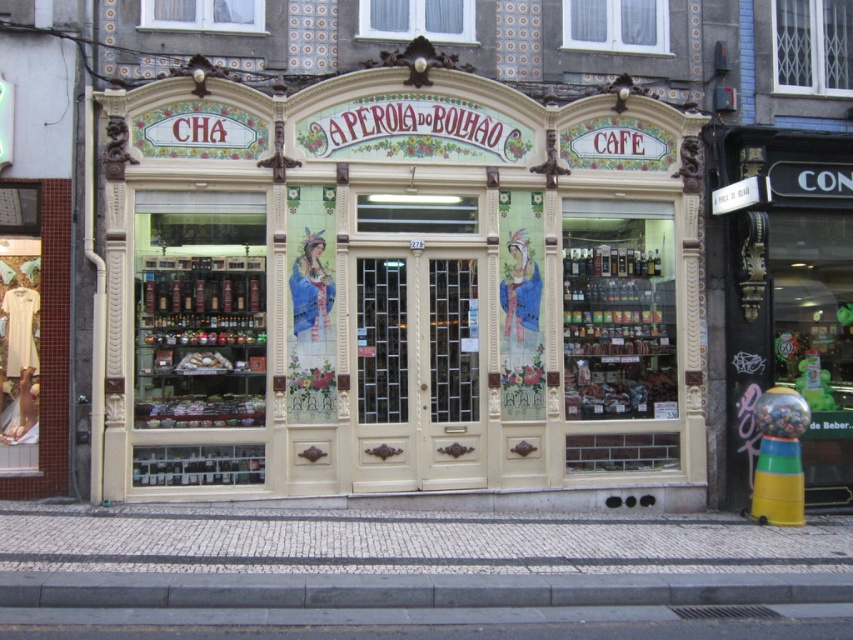
Who is higher up, white painted wood storefront at center or gray concrete curb at lower center?

white painted wood storefront at center is higher up.

Does white painted wood storefront at center lie in front of gray concrete curb at lower center?

No.

I want to click on white painted wood storefront at center, so click(x=397, y=284).